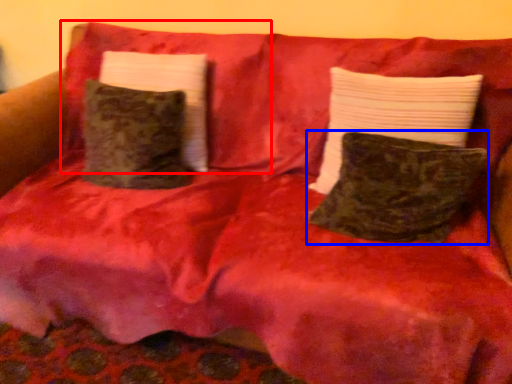
Question: Which point is closer to the camera, pillow (highlighted by a red box) or pillow (highlighted by a blue box)?

Choices:
 (A) pillow
 (B) pillow

Answer: (B)